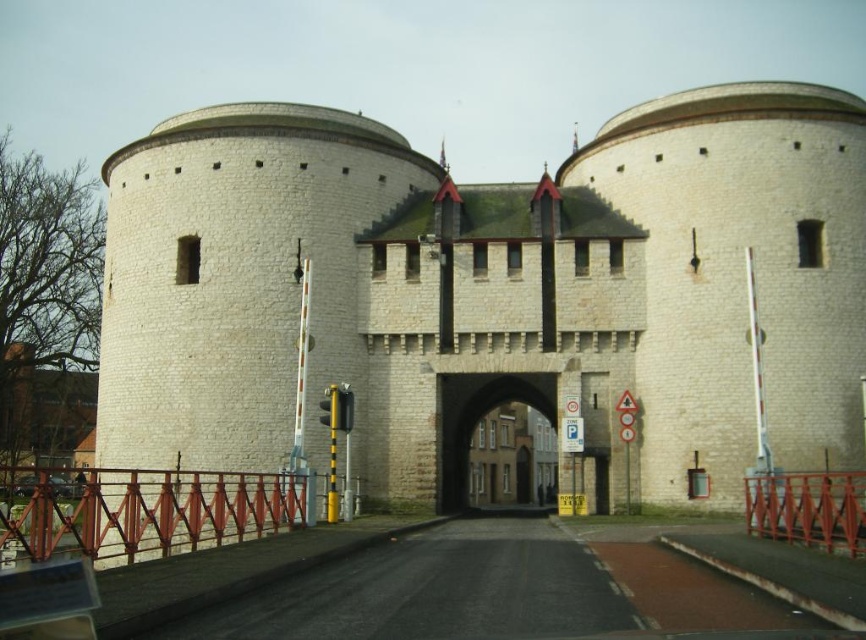
Question: Is white stone castle at center to the left of white stone archway at center from the viewer's perspective?

Choices:
 (A) yes
 (B) no

Answer: (A)

Question: Can you confirm if white stone castle at center is wider than white stone archway at center?

Choices:
 (A) yes
 (B) no

Answer: (A)

Question: Does white stone castle at center appear on the right side of white stone archway at center?

Choices:
 (A) no
 (B) yes

Answer: (A)

Question: Among these points, which one is farthest from the camera?

Choices:
 (A) (466, 432)
 (B) (679, 298)

Answer: (A)